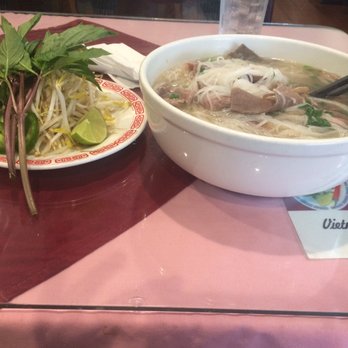
Identify the location of chopsticks. Image resolution: width=348 pixels, height=348 pixels. (331, 85), (338, 90).